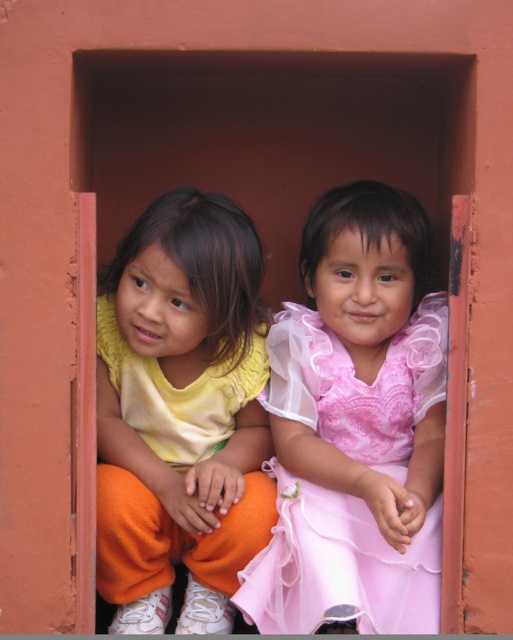
Can you confirm if matte yellow shirt at left is bigger than pink sheer dress at center?

No.

Which is in front, point (167, 257) or point (407, 608)?

Point (407, 608) is in front.

Find the location of a particular element. The height and width of the screenshot is (640, 513). matte yellow shirt at left is located at coordinates [x=181, y=412].